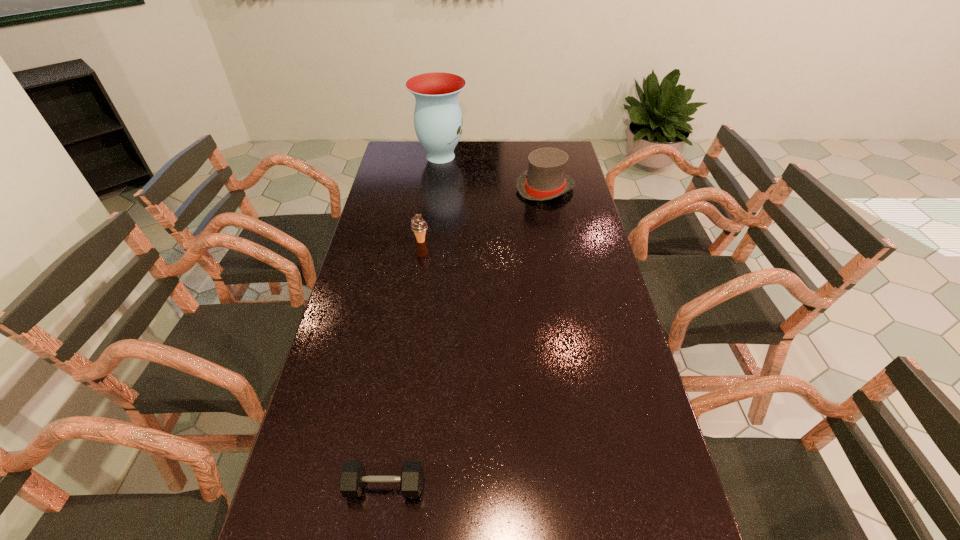
Where is `the farthest object`? the farthest object is located at coordinates (438, 123).

The width and height of the screenshot is (960, 540). Identify the location of vase. (438, 123).

This screenshot has height=540, width=960. In order to click on dress hat in this screenshot , I will do `click(545, 179)`.

Find the location of `the third nearest object`. the third nearest object is located at coordinates (545, 179).

Where is `the third farthest object`? the third farthest object is located at coordinates (418, 225).

The height and width of the screenshot is (540, 960). What are the coordinates of `icecream` in the screenshot? It's located at (418, 225).

Identify the location of the nearest object. (352, 478).

This screenshot has height=540, width=960. Identify the location of the shortest object. (352, 478).

The width and height of the screenshot is (960, 540). Identify the location of blank space located 0.060m on the right of the vase. (481, 156).

The height and width of the screenshot is (540, 960). Find the location of `vacant space located on the left of the second tallest object`. vacant space located on the left of the second tallest object is located at coordinates (441, 188).